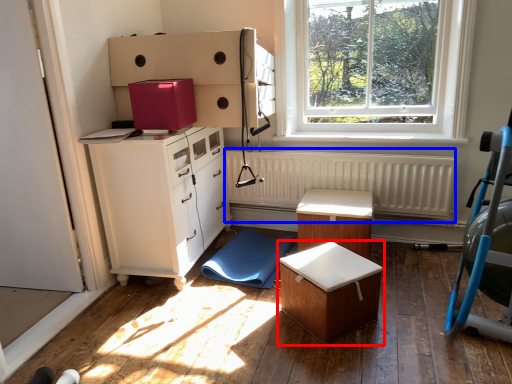
Question: Among these objects, which one is farthest to the camera, table (highlighted by a red box) or radiator (highlighted by a blue box)?

Choices:
 (A) table
 (B) radiator

Answer: (B)